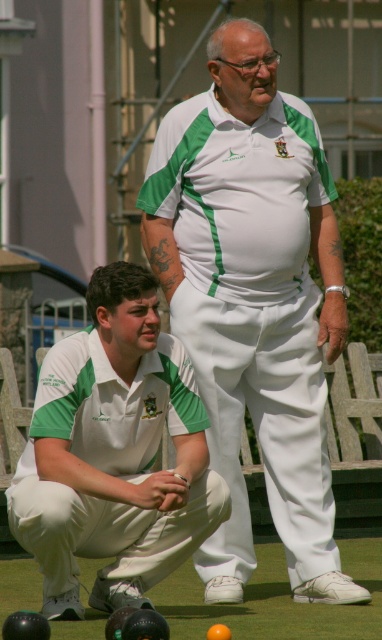
Question: Does white cotton shirt at center have a smaller size compared to white cotton squat at lower left?

Choices:
 (A) no
 (B) yes

Answer: (A)

Question: Which object appears closest to the camera in this image?

Choices:
 (A) white cotton squat at lower left
 (B) white cotton shirt at center

Answer: (A)

Question: In this image, where is white cotton shirt at center located relative to white cotton squat at lower left?

Choices:
 (A) left
 (B) right

Answer: (B)

Question: Can you confirm if white cotton shirt at center is positioned to the left of white cotton squat at lower left?

Choices:
 (A) no
 (B) yes

Answer: (A)

Question: Which of the following is the farthest from the observer?

Choices:
 (A) [85, 419]
 (B) [326, 330]

Answer: (B)